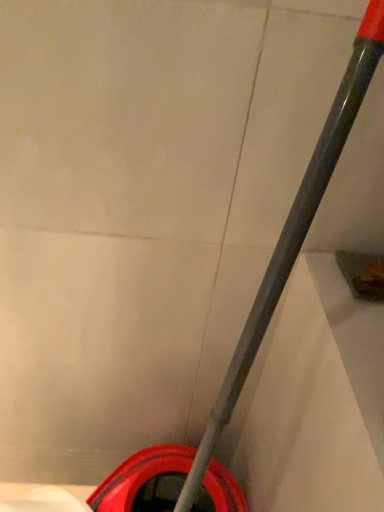
The height and width of the screenshot is (512, 384). Describe the element at coordinates (145, 481) in the screenshot. I see `rubberized red bucket at lower center` at that location.

Based on the photo, measure the distance between rubberized red bucket at lower center and camera.

The depth of rubberized red bucket at lower center is 30.00 inches.

Measure the distance between point (x=109, y=502) and camera.

30.43 inches.

The height and width of the screenshot is (512, 384). I want to click on rubberized red bucket at lower center, so click(145, 481).

This screenshot has width=384, height=512. I want to click on rubberized red bucket at lower center, so pyautogui.click(x=145, y=481).